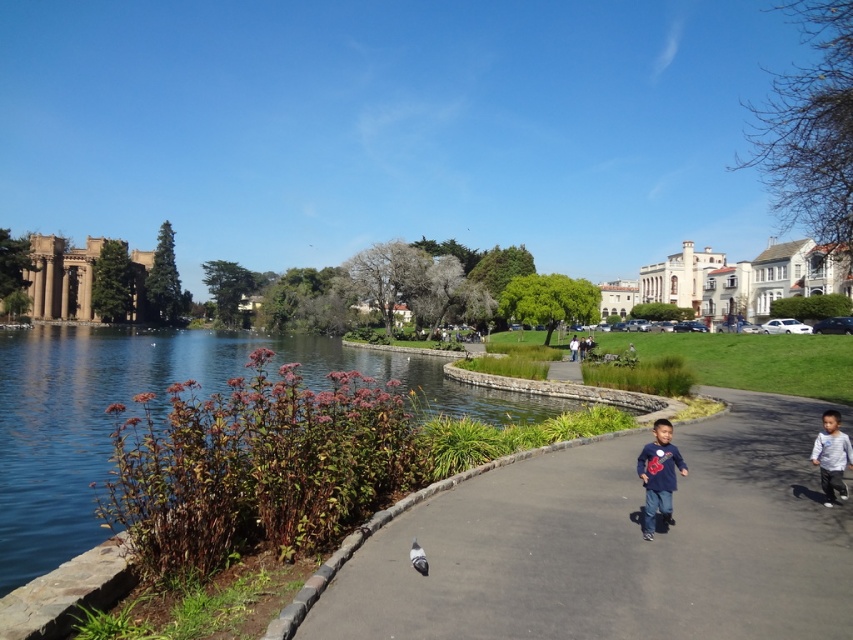
I want to click on smooth asphalt path at center, so click(616, 545).

Is smooth asphalt path at center wider than gray matte pigeon at center?

Yes.

Who is more distant from viewer, (x=497, y=605) or (x=416, y=545)?

Point (x=416, y=545)

Where is `smooth asphalt path at center`? This screenshot has height=640, width=853. smooth asphalt path at center is located at coordinates (616, 545).

Is smooth asphalt path at center bigger than green grassy water at lower left?

No.

Who is more forward, (595, 449) or (12, 417)?

Point (595, 449) is more forward.

Which is in front, point (369, 602) or point (56, 534)?

Point (369, 602) is more forward.

Identify the location of smooth asphalt path at center. (616, 545).

Which is more to the right, green grassy water at lower left or matte gray pants at center?

matte gray pants at center

Measure the distance between point (410, 392) and camera.

A distance of 93.39 meters exists between point (410, 392) and camera.

Identify the location of green grassy water at lower left. This screenshot has width=853, height=640. (160, 394).